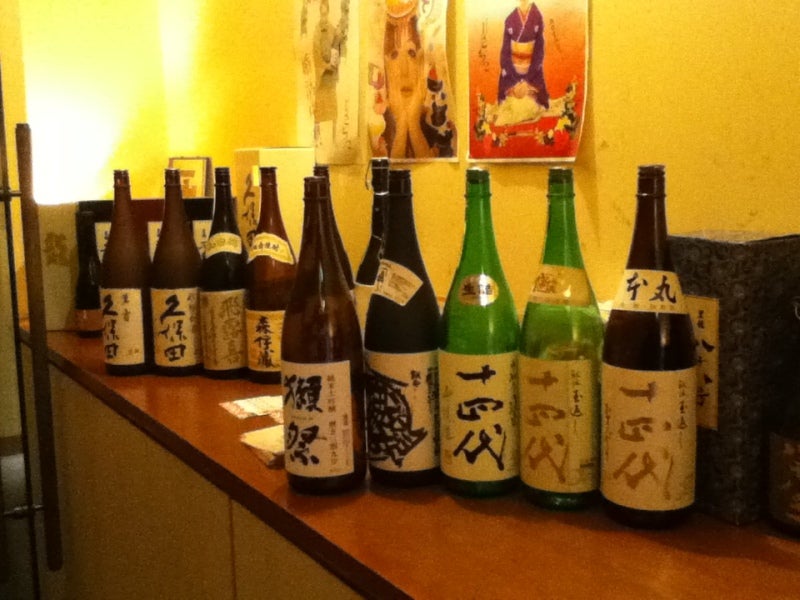
Image resolution: width=800 pixels, height=600 pixels. I want to click on female poster in the middle, so click(x=420, y=83).